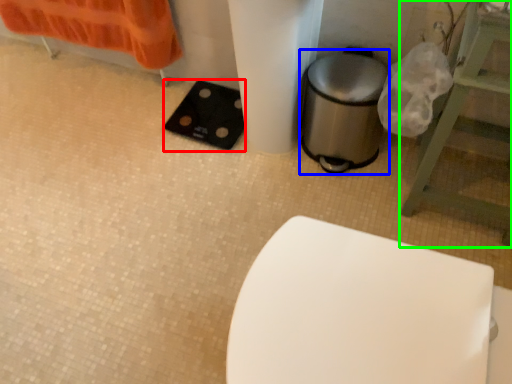
Question: Estimate the real-world distances between objects in this image. Which object is closer to pad (highlighted by a red box), appliance (highlighted by a blue box) or furniture (highlighted by a green box)?

Choices:
 (A) appliance
 (B) furniture

Answer: (A)